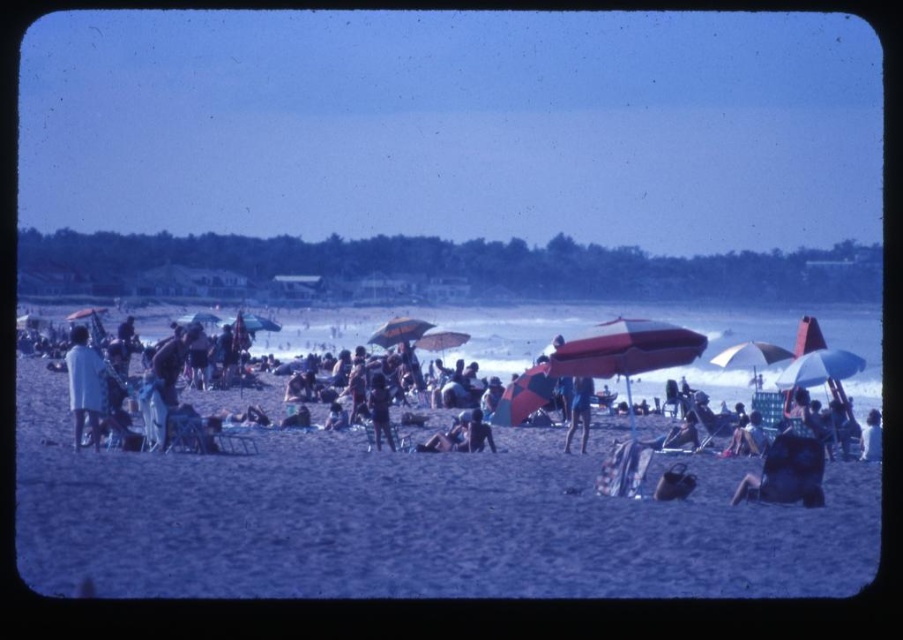
Question: Among these objects, which one is nearest to the camera?

Choices:
 (A) blue denim shorts at center
 (B) red fabric umbrella at center

Answer: (A)

Question: Which of these objects is positioned farthest from the white matte shirt at left?

Choices:
 (A) blue denim shorts at center
 (B) beachgoers at center
 (C) red fabric umbrella at center

Answer: (C)

Question: Can you confirm if red matte umbrella at center is positioned to the left of orange fabric umbrella at center?

Choices:
 (A) no
 (B) yes

Answer: (A)

Question: Among these objects, which one is farthest from the camera?

Choices:
 (A) orange fabric umbrella at center
 (B) red fabric umbrella at center
 (C) white matte shirt at left

Answer: (B)

Question: Is blue denim shorts at center thinner than orange fabric umbrella at center?

Choices:
 (A) no
 (B) yes

Answer: (B)

Question: Does blue denim shorts at center have a larger size compared to yellow fabric umbrella at center?

Choices:
 (A) yes
 (B) no

Answer: (B)